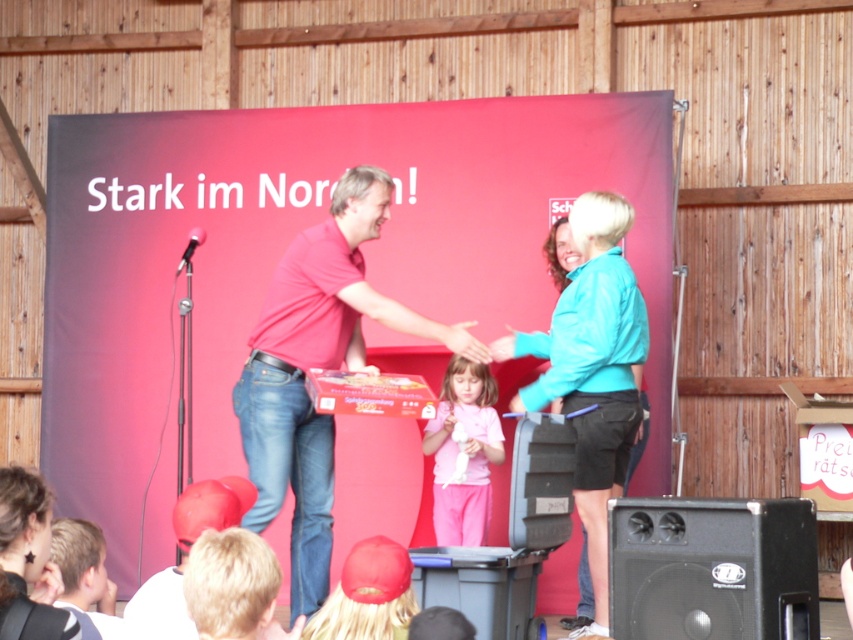
Is pink cotton shirt at center above black plastic microphone at center?

No, pink cotton shirt at center is not above black plastic microphone at center.

Who is positioned more to the right, pink cotton shirt at center or black plastic microphone at center?

pink cotton shirt at center

Image resolution: width=853 pixels, height=640 pixels. Describe the element at coordinates (463, 451) in the screenshot. I see `pink cotton shirt at center` at that location.

Find the location of `pink cotton shirt at center`. pink cotton shirt at center is located at coordinates (463, 451).

Is matte red shirt at center to the right of matte red cap at lower left from the viewer's perspective?

Correct, you'll find matte red shirt at center to the right of matte red cap at lower left.

The width and height of the screenshot is (853, 640). Describe the element at coordinates (317, 368) in the screenshot. I see `matte red shirt at center` at that location.

Does point (303, 612) come behind point (178, 502)?

Yes, point (303, 612) is farther from viewer.

This screenshot has height=640, width=853. What are the coordinates of `matte red shirt at center` in the screenshot? It's located at (317, 368).

The height and width of the screenshot is (640, 853). Identify the location of matte red cap at lower left. (184, 556).

Is point (183, 561) behind point (202, 237)?

No.

The height and width of the screenshot is (640, 853). What do you see at coordinates (184, 556) in the screenshot?
I see `matte red cap at lower left` at bounding box center [184, 556].

Image resolution: width=853 pixels, height=640 pixels. I want to click on matte red cap at lower left, so click(184, 556).